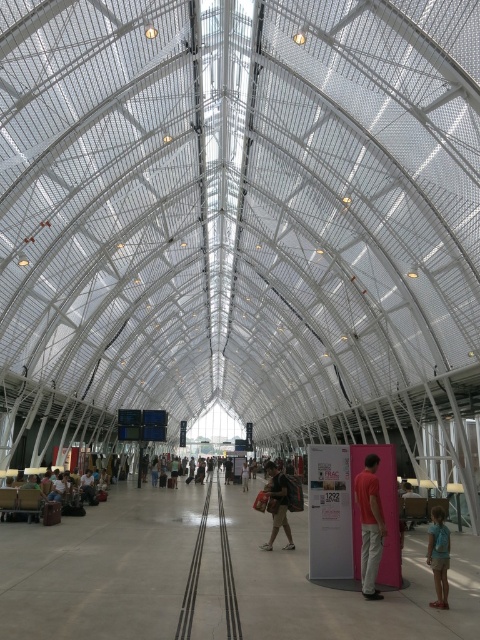
Does dark blue jeans at center appear on the right side of dark brown leather backpack at center?

Incorrect, dark blue jeans at center is not on the right side of dark brown leather backpack at center.

Between dark blue jeans at center and dark brown leather backpack at center, which one has more height?

Standing taller between the two is dark brown leather backpack at center.

Describe the element at coordinates (87, 486) in the screenshot. This screenshot has height=640, width=480. I see `dark blue jeans at center` at that location.

Locate an element on the screen. The width and height of the screenshot is (480, 640). dark blue jeans at center is located at coordinates click(87, 486).

Does blue denim shorts at lower right have a larger size compared to pink fabric at center?

Actually, blue denim shorts at lower right might be smaller than pink fabric at center.

Between point (446, 531) and point (402, 492), which one is positioned in front?

Positioned in front is point (446, 531).

Between point (432, 525) and point (404, 486), which one is positioned behind?

The point (404, 486) is more distant.

Where is `blue denim shorts at lower right`? The height and width of the screenshot is (640, 480). blue denim shorts at lower right is located at coordinates (439, 556).

Does blue denim shorts at lower right appear on the left side of dark blue jeans at center?

No, blue denim shorts at lower right is not to the left of dark blue jeans at center.

Is point (432, 538) more distant than point (93, 490)?

No.

I want to click on blue denim shorts at lower right, so click(x=439, y=556).